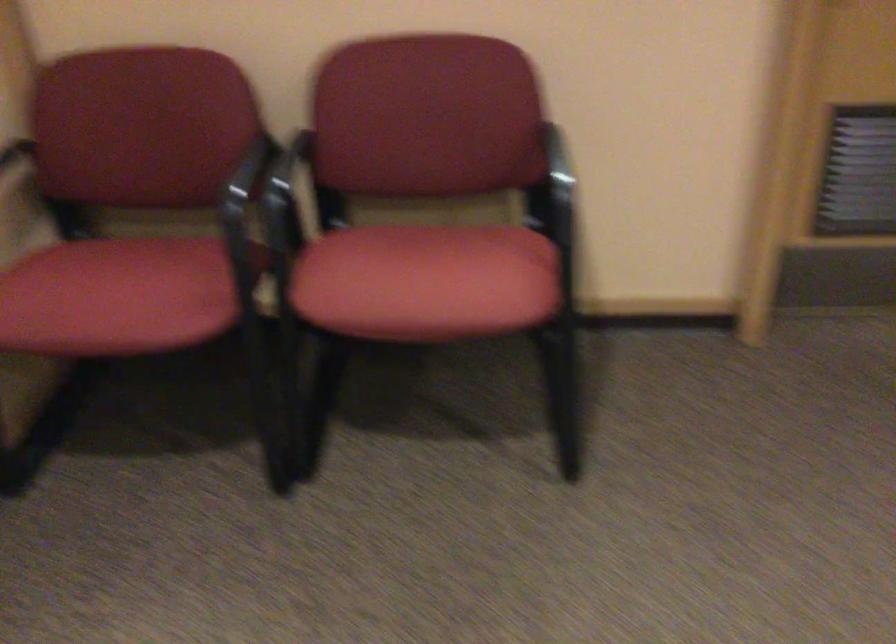
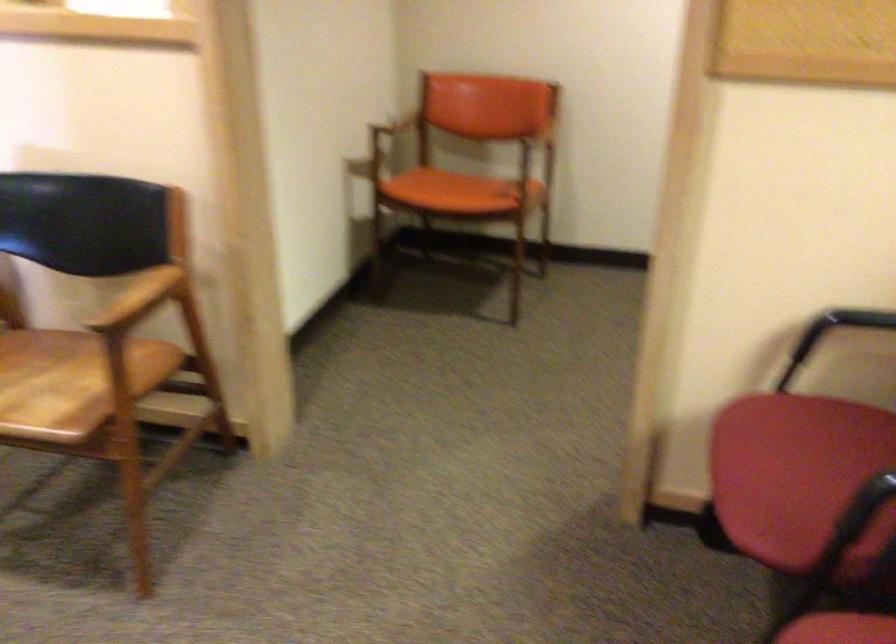
Locate, in the second image, the point that corresponds to the point at 139,290 in the first image.

(798, 477)